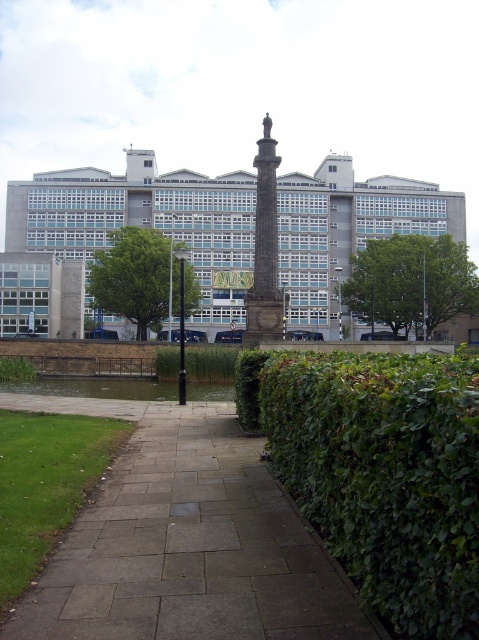
Can you confirm if green leafy hedge at right is wider than green leafy hedge at center?

Incorrect, green leafy hedge at right's width does not surpass green leafy hedge at center's.

Who is higher up, green leafy hedge at right or green leafy hedge at center?

Positioned higher is green leafy hedge at center.

Is point (408, 458) behind point (453, 252)?

No, it is not.

Find the location of `green leafy hedge at right`. green leafy hedge at right is located at coordinates (386, 476).

Between gray stone pavement at center and green leafy hedge at right, which one has more height?

Standing taller between the two is green leafy hedge at right.

The width and height of the screenshot is (479, 640). Identify the location of gray stone pavement at center. (185, 541).

Which is behind, point (312, 576) or point (458, 499)?

The point (312, 576) is behind.

Locate an element on the screen. gray stone pavement at center is located at coordinates (185, 541).

Can you confirm if gray stone pavement at center is positioned to the left of dark gray stone column at center?

Correct, you'll find gray stone pavement at center to the left of dark gray stone column at center.

Can you confirm if gray stone pavement at center is thinner than dark gray stone column at center?

In fact, gray stone pavement at center might be wider than dark gray stone column at center.

Between point (272, 561) and point (259, 189), which one is positioned in front?

Point (272, 561)

Where is `gray stone pavement at center`? gray stone pavement at center is located at coordinates (185, 541).